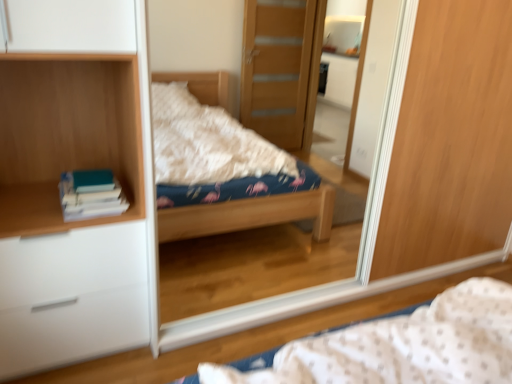
The height and width of the screenshot is (384, 512). Find the location of `white matte chest of drawers at left`. white matte chest of drawers at left is located at coordinates click(72, 296).

Find the location of `teal matte book at left`. teal matte book at left is located at coordinates (90, 194).

This screenshot has height=384, width=512. What do you see at coordinates (270, 243) in the screenshot?
I see `wooden mirror at center` at bounding box center [270, 243].

Locate an element on the screen. The width and height of the screenshot is (512, 384). wooden bookshelf at left is located at coordinates (66, 134).

Can you tell me how much fluffy fabric bed at center and wooden bookshelf at left differ in facing direction?

They differ by 178 degrees in their facing directions.

Can we say fluffy fabric bed at center lies outside wooden bookshelf at left?

Yes.

Which of these two, fluffy fabric bed at center or wooden bookshelf at left, is wider?

Wider between the two is fluffy fabric bed at center.

How many degrees apart are the facing directions of wooden mirror at center and fluffy fabric bed at center?

The angle between the facing direction of wooden mirror at center and the facing direction of fluffy fabric bed at center is 179 degrees.

From the image's perspective, is wooden mirror at center positioned above or below fluffy fabric bed at center?

Clearly, from the image's perspective, wooden mirror at center is above fluffy fabric bed at center.

Would you say wooden mirror at center is inside or outside fluffy fabric bed at center?

wooden mirror at center is not enclosed by fluffy fabric bed at center.

Where is `book behind the wooden mirror at center`? book behind the wooden mirror at center is located at coordinates (90, 194).

In the scene shown: Considering the relative sizes of teal matte book at left and wooden mirror at center in the image provided, is teal matte book at left thinner than wooden mirror at center?

No, teal matte book at left is not thinner than wooden mirror at center.

Considering the positions of points (81, 198) and (354, 243), is point (81, 198) farther from camera compared to point (354, 243)?

No.

Considering the relative sizes of teal matte book at left and wooden mirror at center in the image provided, is teal matte book at left taller than wooden mirror at center?

Incorrect, the height of teal matte book at left is not larger of that of wooden mirror at center.

I want to click on book below the wooden bookshelf at left (from the image's perspective), so click(x=90, y=194).

Is teal matte book at left facing towards wooden bookshelf at left?

Yes, teal matte book at left is facing wooden bookshelf at left.

In the image, is teal matte book at left positioned in front of or behind wooden bookshelf at left?

teal matte book at left is positioned farther from the viewer than wooden bookshelf at left.

Considering the sizes of objects teal matte book at left and wooden bookshelf at left in the image provided, who is shorter, teal matte book at left or wooden bookshelf at left?

With less height is teal matte book at left.

Is wooden mirror at center positioned beyond the bounds of wooden bookshelf at left?

Yes, wooden mirror at center is not within wooden bookshelf at left.

From the image's perspective, which is below, wooden mirror at center or wooden bookshelf at left?

wooden mirror at center.

How far apart are wooden mirror at center and wooden bookshelf at left?

The distance of wooden mirror at center from wooden bookshelf at left is 3.78 feet.

Is wooden mirror at center not close to wooden bookshelf at left?

Yes, wooden mirror at center and wooden bookshelf at left are located far from each other.

Can you tell me how much wooden bookshelf at left and wooden mirror at center differ in facing direction?

The facing directions of wooden bookshelf at left and wooden mirror at center are 1.14 degrees apart.

From the image's perspective, which is below, wooden bookshelf at left or wooden mirror at center?

wooden mirror at center.

Would you say wooden bookshelf at left is to the left or to the right of wooden mirror at center in the picture?

wooden bookshelf at left is to the left of wooden mirror at center.

Who is shorter, wooden bookshelf at left or wooden mirror at center?

wooden bookshelf at left is shorter.

Is fluffy fabric bed at center surrounding teal matte book at left?

No.

Which is less distant, (x=298, y=381) or (x=97, y=216)?

Point (x=298, y=381).

In the scene shown: Is fluffy fabric bed at center to the left or to the right of teal matte book at left in the image?

fluffy fabric bed at center is to the right of teal matte book at left.

I want to click on book on the left of fluffy fabric bed at center, so click(x=90, y=194).

The width and height of the screenshot is (512, 384). What are the coordinates of `bed in front of the wooden bookshelf at left` in the screenshot? It's located at pyautogui.click(x=401, y=344).

The width and height of the screenshot is (512, 384). Find the location of `mirror on the right side of fluffy fabric bed at center`. mirror on the right side of fluffy fabric bed at center is located at coordinates (270, 243).

When comparing their distances from wooden bookshelf at left, does fluffy fabric bed at center or white matte chest of drawers at left seem further?

fluffy fabric bed at center lies further to wooden bookshelf at left than the other object.

Considering their positions, is white matte chest of drawers at left positioned further to teal matte book at left than fluffy fabric bed at center?

fluffy fabric bed at center is positioned further to the anchor teal matte book at left.

Which object lies further to the anchor point wooden bookshelf at left, teal matte book at left or wooden mirror at center?

wooden mirror at center.

Looking at the image, which one is located further to wooden mirror at center, wooden bookshelf at left or white matte chest of drawers at left?

wooden bookshelf at left lies further to wooden mirror at center than the other object.

Estimate the real-world distances between objects in this image. Which object is further from teal matte book at left, wooden bookshelf at left or fluffy fabric bed at center?

Among the two, fluffy fabric bed at center is located further to teal matte book at left.

Looking at the image, which one is located further to wooden mirror at center, white matte chest of drawers at left or fluffy fabric bed at center?

fluffy fabric bed at center is further to wooden mirror at center.

Considering their positions, is wooden mirror at center positioned further to white matte chest of drawers at left than teal matte book at left?

Among the two, wooden mirror at center is located further to white matte chest of drawers at left.

When comparing their distances from wooden mirror at center, does fluffy fabric bed at center or wooden bookshelf at left seem closer?

wooden bookshelf at left is positioned closer to the anchor wooden mirror at center.

Image resolution: width=512 pixels, height=384 pixels. I want to click on cabinet between white matte chest of drawers at left and fluffy fabric bed at center, so click(x=66, y=134).

At what (x,y) coordinates should I click in order to perform the action: click on bed situated between teal matte book at left and wooden mirror at center from left to right. Please return your answer as a coordinate pair (x, y). Looking at the image, I should click on (401, 344).

The image size is (512, 384). What are the coordinates of `book situated between wooden bookshelf at left and wooden mirror at center from left to right` in the screenshot? It's located at (90, 194).

The height and width of the screenshot is (384, 512). In order to click on cabinet situated between white matte chest of drawers at left and wooden mirror at center from left to right in this screenshot , I will do `click(66, 134)`.